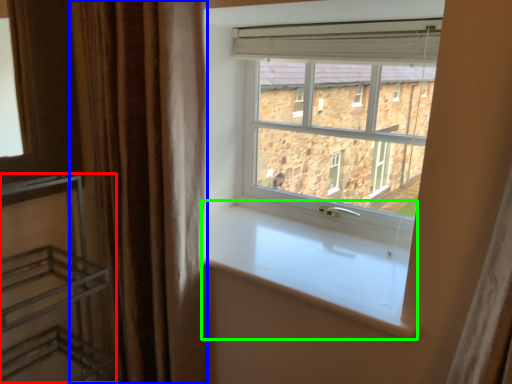
Question: Estimate the real-world distances between objects in this image. Which object is farther from shelf (highlighted by a red box), curtain (highlighted by a blue box) or window sill (highlighted by a green box)?

Choices:
 (A) curtain
 (B) window sill

Answer: (B)